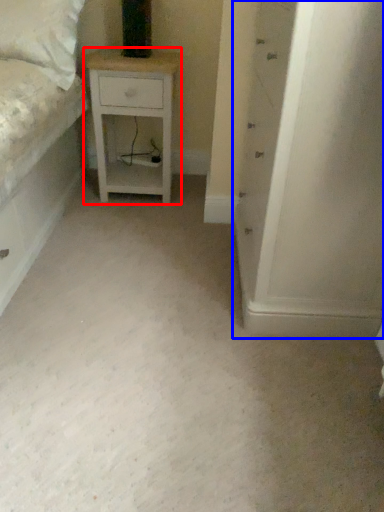
Question: Among these objects, which one is farthest to the camera, nightstand (highlighted by a red box) or chest of drawers (highlighted by a blue box)?

Choices:
 (A) nightstand
 (B) chest of drawers

Answer: (A)